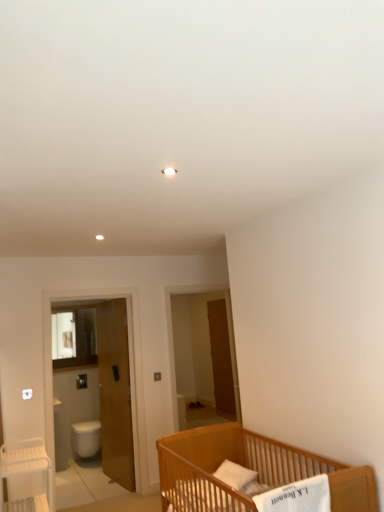
Measure the distance between point [263,449] and camera.

Point [263,449] is 11.24 feet away from camera.

What is the approximate width of white plastic table at lower left?

white plastic table at lower left is 37.47 centimeters wide.

Locate an element on the screen. The image size is (384, 512). white glossy toilet bowl at lower left is located at coordinates (86, 438).

At what (x,y) coordinates should I click in order to perform the action: click on brown wooden screen door at center, placed as the 2th screen door when sorted from left to right. Please return your answer as a coordinate pair (x, y). The image size is (384, 512). Looking at the image, I should click on click(221, 356).

What do you see at coordinates (115, 392) in the screenshot? This screenshot has height=512, width=384. I see `wooden door at left` at bounding box center [115, 392].

Find the location of a particular element. The height and width of the screenshot is (512, 384). light brown wooden crib at lower right is located at coordinates (251, 468).

From the picture: How much distance is there between white plastic table at lower left and wooden door at left?

white plastic table at lower left is 4.42 feet from wooden door at left.

Who is smaller, white plastic table at lower left or wooden door at left?

With smaller size is white plastic table at lower left.

Which is in front, point (33, 470) or point (131, 436)?

The point (33, 470) is in front.

Which object is closer to the camera, white plastic table at lower left or wooden door at left?

white plastic table at lower left is closer to the camera.

Could you tell me if wooden door at left is facing white plastic table at lower left?

No, wooden door at left is not aimed at white plastic table at lower left.

Considering the relative sizes of wooden door at left and white plastic table at lower left in the image provided, is wooden door at left smaller than white plastic table at lower left?

Actually, wooden door at left might be larger than white plastic table at lower left.

Considering the sizes of wooden door at left and white plastic table at lower left in the image, is wooden door at left wider or thinner than white plastic table at lower left?

In the image, wooden door at left appears to be more narrow than white plastic table at lower left.

How many degrees apart are the facing directions of wooden door at left and white plastic table at lower left?

wooden door at left and white plastic table at lower left are facing 171 degrees away from each other.

Is brown wooden screen door at center, the 2th screen door when ordered from front to back, further to camera compared to wooden door at left?

Yes, brown wooden screen door at center, the 2th screen door when ordered from front to back, is further from the viewer.

Is brown wooden screen door at center, placed as the 2th screen door when sorted from left to right, next to wooden door at left and touching it?

No, brown wooden screen door at center, placed as the 2th screen door when sorted from left to right, is not touching wooden door at left.

Is wooden door at left at the back of brown wooden screen door at center, which ranks as the first screen door in back-to-front order?

No, wooden door at left is not at the back of brown wooden screen door at center, which ranks as the first screen door in back-to-front order.

Which object is thinner, brown wooden screen door at center, which ranks as the first screen door in back-to-front order, or wooden door at left?

Thinner between the two is brown wooden screen door at center, which ranks as the first screen door in back-to-front order.

From their relative heights in the image, would you say white glossy toilet bowl at lower left is taller or shorter than light brown wooden crib at lower right?

Considering their sizes, white glossy toilet bowl at lower left has less height than light brown wooden crib at lower right.

Which is nearer, (99,426) or (169,465)?

Point (99,426) is farther from the camera than point (169,465).

From a real-world perspective, between white glossy toilet bowl at lower left and light brown wooden crib at lower right, who is vertically lower?

From a 3D spatial view, white glossy toilet bowl at lower left is below.

Could you measure the distance between white glossy toilet bowl at lower left and light brown wooden crib at lower right?

9.60 feet.

Looking at this image, is white glossy screen door at left, the 2th screen door positioned from the back, facing away from brown wooden screen door at center, the 2th screen door when ordered from front to back?

No, white glossy screen door at left, the 2th screen door positioned from the back, is not facing away from brown wooden screen door at center, the 2th screen door when ordered from front to back.

Which point is more distant from viewer, (108,476) or (213,358)?

The point (213,358) is more distant.

Is white glossy screen door at left, which is the second screen door from right to left, wider or thinner than brown wooden screen door at center, which ranks as the first screen door in back-to-front order?

Clearly, white glossy screen door at left, which is the second screen door from right to left, has more width compared to brown wooden screen door at center, which ranks as the first screen door in back-to-front order.

Who is bigger, white glossy screen door at left, placed as the 1th screen door when sorted from left to right, or brown wooden screen door at center, the 2th screen door when ordered from front to back?

With larger size is white glossy screen door at left, placed as the 1th screen door when sorted from left to right.

Locate an element on the screen. the 1st screen door counting from the right side of the white plastic table at lower left is located at coordinates tap(98, 387).

From a real-world perspective, is white plastic table at lower left on white glossy screen door at left, placed as the 1th screen door when sorted from left to right?

No.

Is white glossy screen door at left, placed as the 1th screen door when sorted from left to right, inside white plastic table at lower left?

No, white glossy screen door at left, placed as the 1th screen door when sorted from left to right, is not inside white plastic table at lower left.

Is white plastic table at lower left facing away from white glossy screen door at left, which is the second screen door from right to left?

No, white glossy screen door at left, which is the second screen door from right to left, is not at the back of white plastic table at lower left.

Is white glossy screen door at left, marked as the first screen door in a front-to-back arrangement, looking in the opposite direction of light brown wooden crib at lower right?

No, white glossy screen door at left, marked as the first screen door in a front-to-back arrangement, is not facing the opposite direction of light brown wooden crib at lower right.

Considering the sizes of objects white glossy screen door at left, placed as the 1th screen door when sorted from left to right, and light brown wooden crib at lower right in the image provided, who is shorter, white glossy screen door at left, placed as the 1th screen door when sorted from left to right, or light brown wooden crib at lower right?

Standing shorter between the two is light brown wooden crib at lower right.

In the scene shown: Can we say white glossy screen door at left, which is the second screen door from right to left, lies outside light brown wooden crib at lower right?

white glossy screen door at left, which is the second screen door from right to left, lies outside light brown wooden crib at lower right's area.

The height and width of the screenshot is (512, 384). Find the location of `door that is above the white plastic table at lower left (from a real-world perspective)`. door that is above the white plastic table at lower left (from a real-world perspective) is located at coordinates (115, 392).

Where is `door lying above the white plastic table at lower left (from the image's perspective)`? This screenshot has height=512, width=384. door lying above the white plastic table at lower left (from the image's perspective) is located at coordinates (115, 392).

Looking at the image, which one is located further to brown wooden screen door at center, which ranks as the first screen door in back-to-front order, white glossy screen door at left, marked as the first screen door in a front-to-back arrangement, or wooden door at left?

white glossy screen door at left, marked as the first screen door in a front-to-back arrangement, is positioned further to the anchor brown wooden screen door at center, which ranks as the first screen door in back-to-front order.

When comparing their distances from wooden door at left, does white plastic table at lower left or white glossy toilet bowl at lower left seem closer?

white glossy toilet bowl at lower left lies closer to wooden door at left than the other object.

Looking at this image, which object lies further to the anchor point wooden door at left, white glossy screen door at left, which is the second screen door from right to left, or light brown wooden crib at lower right?

light brown wooden crib at lower right.

Considering their positions, is light brown wooden crib at lower right positioned closer to white glossy toilet bowl at lower left than brown wooden screen door at center, placed as the 2th screen door when sorted from left to right?

Among the two, brown wooden screen door at center, placed as the 2th screen door when sorted from left to right, is located nearer to white glossy toilet bowl at lower left.

Which object lies further to the anchor point white glossy screen door at left, the 2th screen door positioned from the back, wooden door at left or white plastic table at lower left?

white plastic table at lower left.

Estimate the real-world distances between objects in this image. Which object is further from white glossy toilet bowl at lower left, brown wooden screen door at center, the 2th screen door when ordered from front to back, or white plastic table at lower left?

Based on the image, white plastic table at lower left appears to be further to white glossy toilet bowl at lower left.

Estimate the real-world distances between objects in this image. Which object is closer to light brown wooden crib at lower right, white glossy toilet bowl at lower left or brown wooden screen door at center, placed as the 2th screen door when sorted from left to right?

brown wooden screen door at center, placed as the 2th screen door when sorted from left to right, is closer to light brown wooden crib at lower right.

When comparing their distances from white plastic table at lower left, does brown wooden screen door at center, the 2th screen door when ordered from front to back, or white glossy toilet bowl at lower left seem closer?

The object closer to white plastic table at lower left is white glossy toilet bowl at lower left.

The image size is (384, 512). Find the location of `screen door between white plastic table at lower left and white glossy toilet bowl at lower left in the front-back direction`. screen door between white plastic table at lower left and white glossy toilet bowl at lower left in the front-back direction is located at coordinates (98, 387).

Locate an element on the screen. screen door between light brown wooden crib at lower right and wooden door at left in the front-back direction is located at coordinates (x=98, y=387).

Image resolution: width=384 pixels, height=512 pixels. I want to click on door between white plastic table at lower left and white glossy toilet bowl at lower left in the front-back direction, so click(x=115, y=392).

Locate an element on the screen. Image resolution: width=384 pixels, height=512 pixels. toilet bowl located between white plastic table at lower left and brown wooden screen door at center, positioned as the first screen door in right-to-left order, in the depth direction is located at coordinates (86, 438).